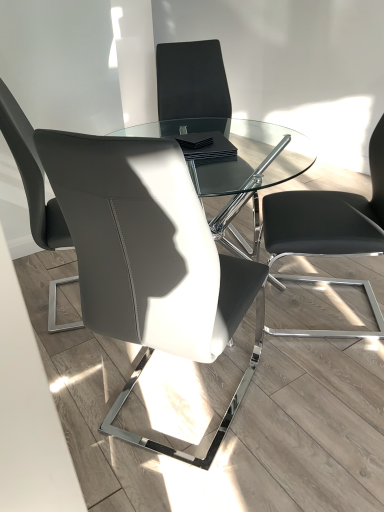
Question: Is the surface of matte black chair at center, acting as the 3th chair starting from the left, in direct contact with matte gray leather chair at left, placed as the 4th chair when sorted from right to left?

Choices:
 (A) no
 (B) yes

Answer: (A)

Question: Is matte black chair at center, acting as the 3th chair starting from the left, further to camera compared to matte gray leather chair at left, placed as the 4th chair when sorted from right to left?

Choices:
 (A) no
 (B) yes

Answer: (B)

Question: Can you confirm if matte black chair at center, acting as the 3th chair starting from the left, is shorter than matte gray leather chair at left, placed as the 4th chair when sorted from right to left?

Choices:
 (A) yes
 (B) no

Answer: (B)

Question: From a real-world perspective, is matte black chair at center, which is the 2th chair from right to left, physically below matte gray leather chair at left, placed as the 4th chair when sorted from right to left?

Choices:
 (A) no
 (B) yes

Answer: (B)

Question: Is matte gray leather chair at left, placed as the 4th chair when sorted from right to left, at the back of matte black chair at center, which is the 2th chair from right to left?

Choices:
 (A) no
 (B) yes

Answer: (A)

Question: Is matte black chair at center, acting as the 3th chair starting from the left, smaller than matte gray leather chair at left, the 1th chair in the left-to-right sequence?

Choices:
 (A) yes
 (B) no

Answer: (B)

Question: Is matte gray leather chair at left, placed as the 4th chair when sorted from right to left, thinner than black leather chair at right, the 1th chair positioned from the right?

Choices:
 (A) yes
 (B) no

Answer: (A)

Question: Is matte gray leather chair at left, placed as the 4th chair when sorted from right to left, wider than black leather chair at right, the 1th chair positioned from the right?

Choices:
 (A) no
 (B) yes

Answer: (A)

Question: From the image's perspective, does matte gray leather chair at left, placed as the 4th chair when sorted from right to left, appear higher than black leather chair at right, the 1th chair positioned from the right?

Choices:
 (A) yes
 (B) no

Answer: (A)

Question: From a real-world perspective, is matte gray leather chair at left, the 1th chair in the left-to-right sequence, physically below black leather chair at right, the 1th chair positioned from the right?

Choices:
 (A) yes
 (B) no

Answer: (B)

Question: Is matte gray leather chair at left, placed as the 4th chair when sorted from right to left, taller than black leather chair at right, arranged as the fourth chair when viewed from the left?

Choices:
 (A) no
 (B) yes

Answer: (B)

Question: Is matte gray leather chair at left, the 1th chair in the left-to-right sequence, shorter than black leather chair at right, arranged as the fourth chair when viewed from the left?

Choices:
 (A) yes
 (B) no

Answer: (B)

Question: Does matte black chair at center, which is the 3th chair from right to left, contain matte gray leather chair at left, placed as the 4th chair when sorted from right to left?

Choices:
 (A) yes
 (B) no

Answer: (B)